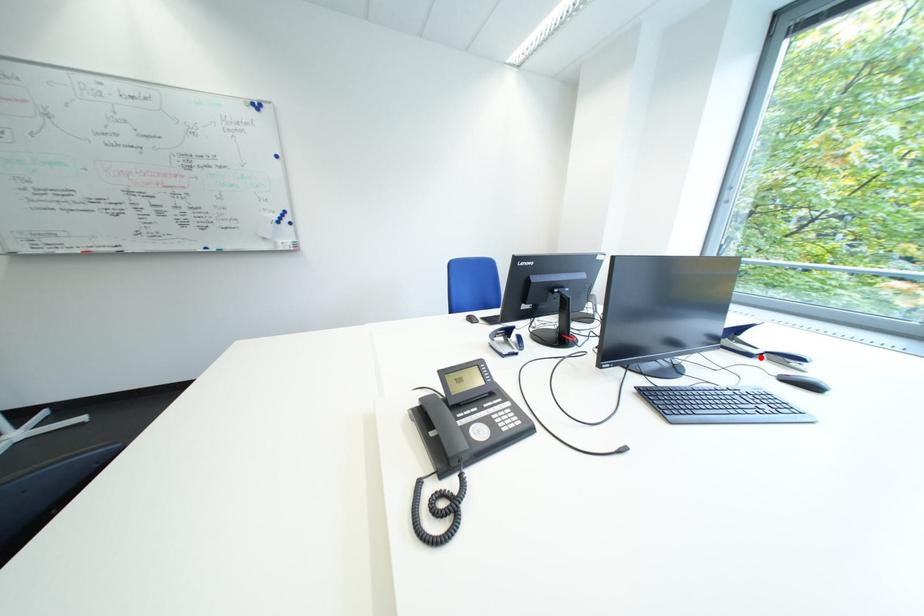
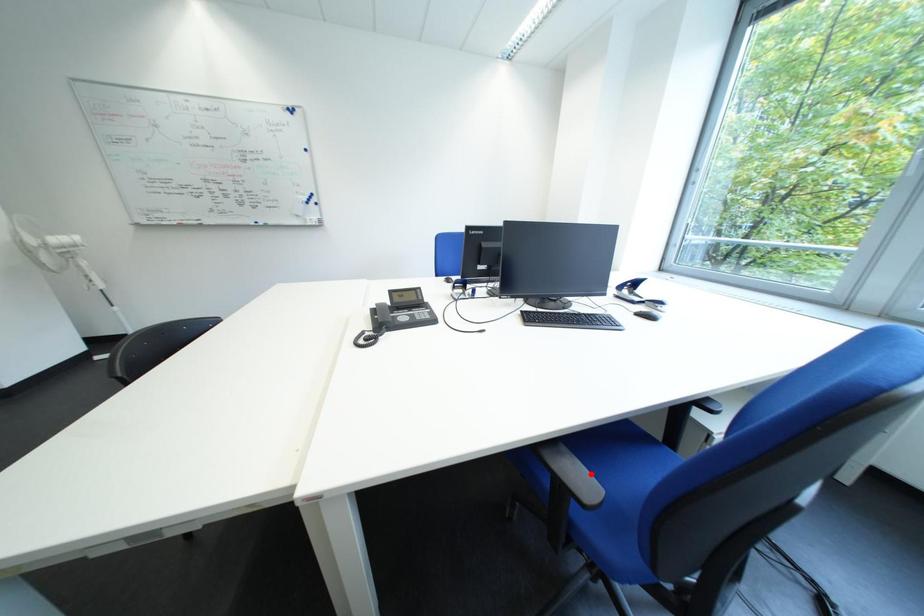
I am providing you with two images of the same scene from different viewpoints. A red point is marked on the first image and another point is marked on the second image. Does the point marked in image1 correspond to the same location as the one in image2?

No